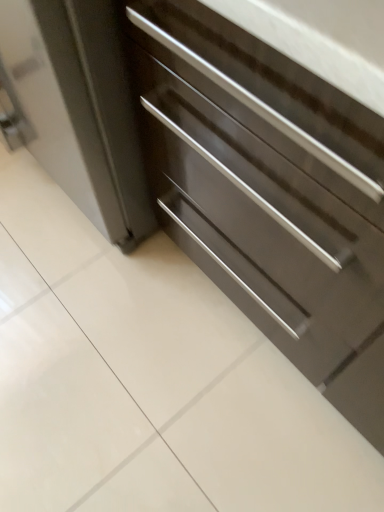
Identify the location of glossy dark brown drawer at center. (262, 226).

The height and width of the screenshot is (512, 384). Describe the element at coordinates (262, 226) in the screenshot. I see `glossy dark brown drawer at center` at that location.

Locate an element on the screen. This screenshot has width=384, height=512. glossy dark brown drawer at center is located at coordinates (262, 226).